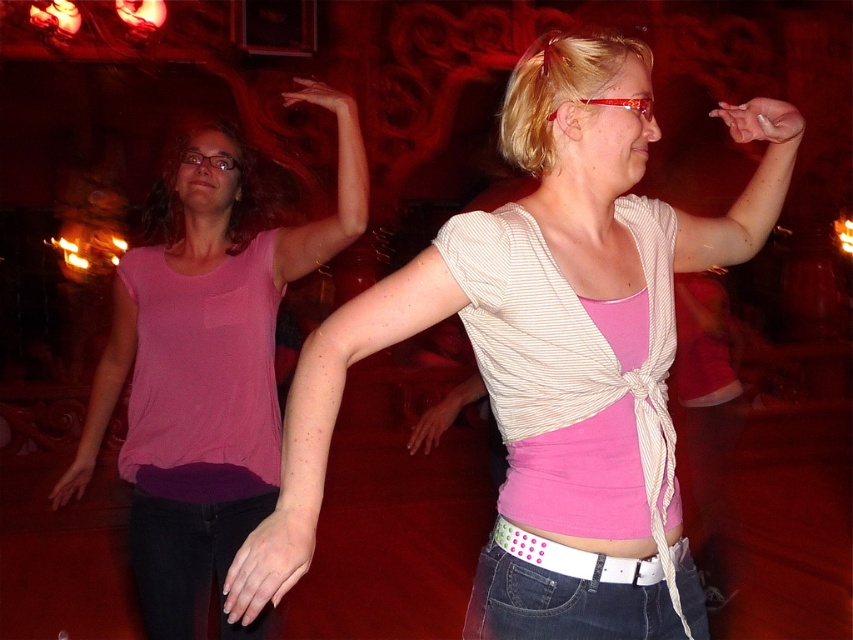
Can you confirm if pink fabric shirt at left is positioned to the right of black denim jeans at lower left?

No, pink fabric shirt at left is not to the right of black denim jeans at lower left.

Is point (129, 339) less distant than point (149, 515)?

No, it is behind (149, 515).

Which is behind, point (90, 444) or point (189, 564)?

The point (90, 444) is more distant.

Where is `pink fabric shirt at left`? The height and width of the screenshot is (640, 853). pink fabric shirt at left is located at coordinates (206, 364).

How distant is pink striped shirt at center from black denim jeans at lower left?

A distance of 3.69 feet exists between pink striped shirt at center and black denim jeans at lower left.

Is pink striped shirt at center smaller than black denim jeans at lower left?

Incorrect, pink striped shirt at center is not smaller in size than black denim jeans at lower left.

Measure the distance between point (236, 560) and camera.

A distance of 1.28 meters exists between point (236, 560) and camera.

Locate an element on the screen. The image size is (853, 640). pink striped shirt at center is located at coordinates (550, 356).

Can you confirm if denim jeans at lower center is positioned to the left of black denim jeans at lower left?

No, denim jeans at lower center is not to the left of black denim jeans at lower left.

Who is more distant from viewer, (595, 611) or (170, 628)?

The point (170, 628) is behind.

At what (x,y) coordinates should I click in order to perform the action: click on denim jeans at lower center. Please return your answer as a coordinate pair (x, y). Looking at the image, I should click on (578, 593).